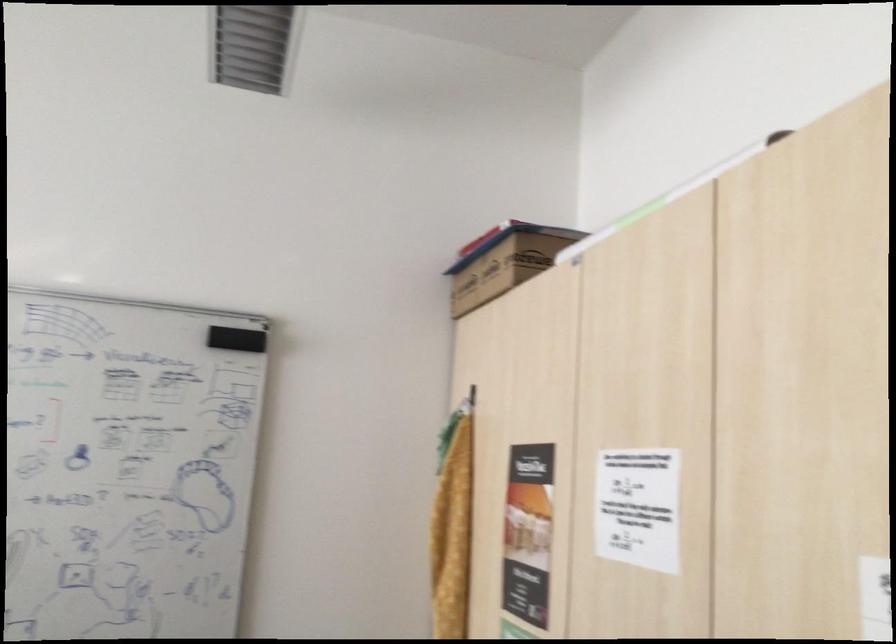
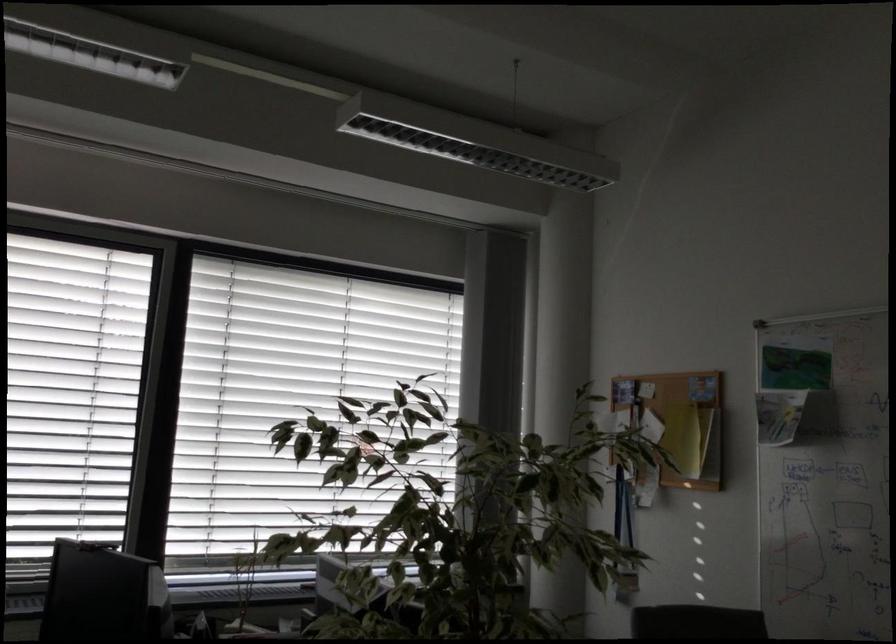
Question: The camera is either moving clockwise (left) or counter-clockwise (right) around the object. The first image is from the beginning of the video and the second image is from the end. Is the camera moving left or right when shooting the video?

Choices:
 (A) Left
 (B) Right

Answer: (B)